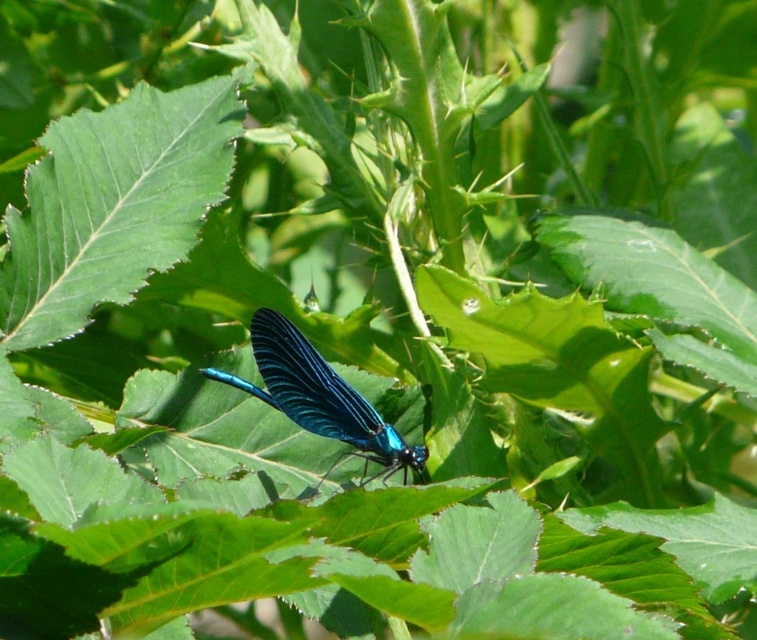
Who is taller, green smooth leaf at center or glossy metallic blue dragonfly at center?

green smooth leaf at center

Does point (136, 156) come farther from viewer compared to point (403, 481)?

Yes.

Is point (58, 237) less distant than point (294, 408)?

No, it is behind (294, 408).

The image size is (757, 640). I want to click on green smooth leaf at center, so click(114, 204).